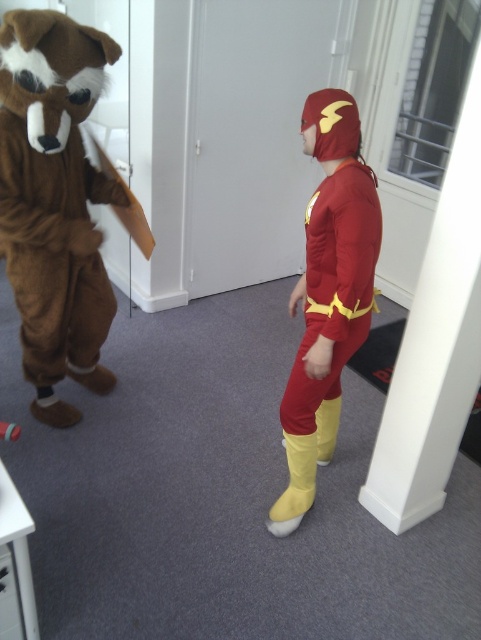
Question: Is brown furry costume at left to the right of shiny red fabric superhero suit at center from the viewer's perspective?

Choices:
 (A) no
 (B) yes

Answer: (A)

Question: Does brown furry costume at left appear under shiny red fabric superhero suit at center?

Choices:
 (A) yes
 (B) no

Answer: (B)

Question: Can you confirm if brown furry costume at left is positioned to the left of shiny red fabric superhero suit at center?

Choices:
 (A) no
 (B) yes

Answer: (B)

Question: Which object is closer to the camera taking this photo?

Choices:
 (A) shiny red fabric superhero suit at center
 (B) brown furry costume at left

Answer: (A)